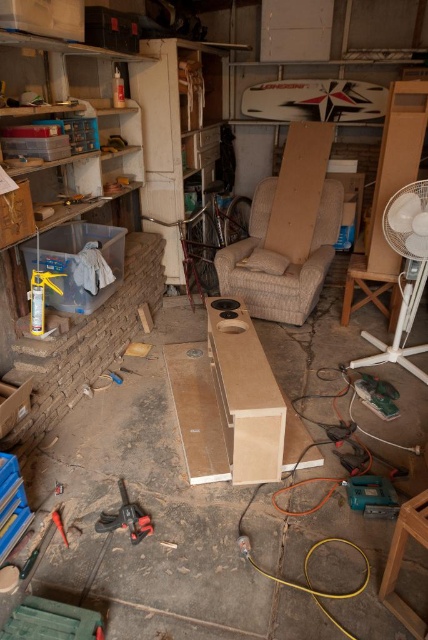
You are organizing the workshop and need to place the translucent plastic box at left and the white plastic fan at right into a storage container. Which object should you place first if you want to maximize the space efficiently?

You should place the translucent plastic box at left first because it is smaller than the white plastic fan at right, allowing the larger item to fit into the remaining space more easily.

You are organizing the clutter in this workshop and need to stack items vertically. Given the height of the matte brown cardboard box at left and the black rubber drill at lower left, which item can you place on top without exceeding the height of the other?

The matte brown cardboard box at left is taller than the black rubber drill at lower left, so you can place the black rubber drill at lower left on top of the matte brown cardboard box at left without exceeding its height.